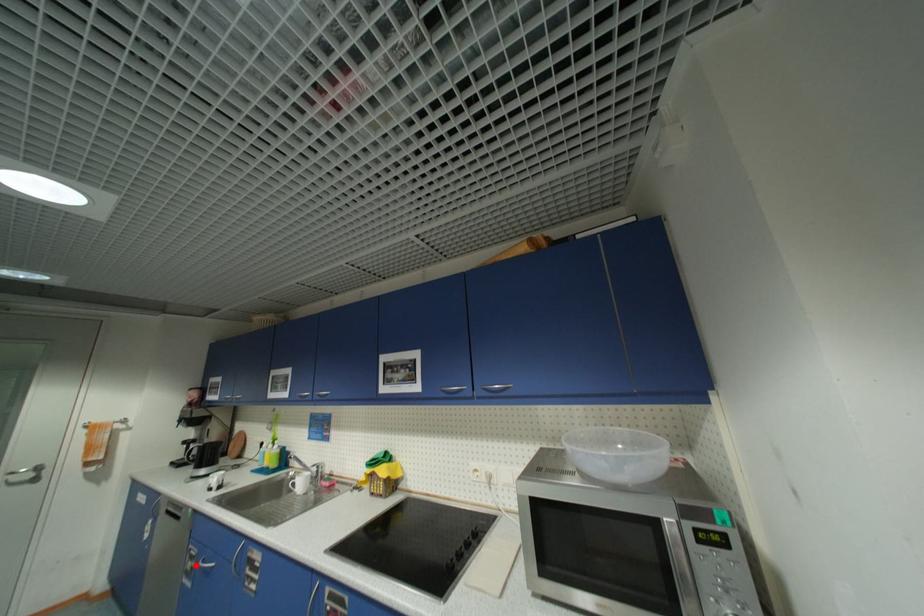
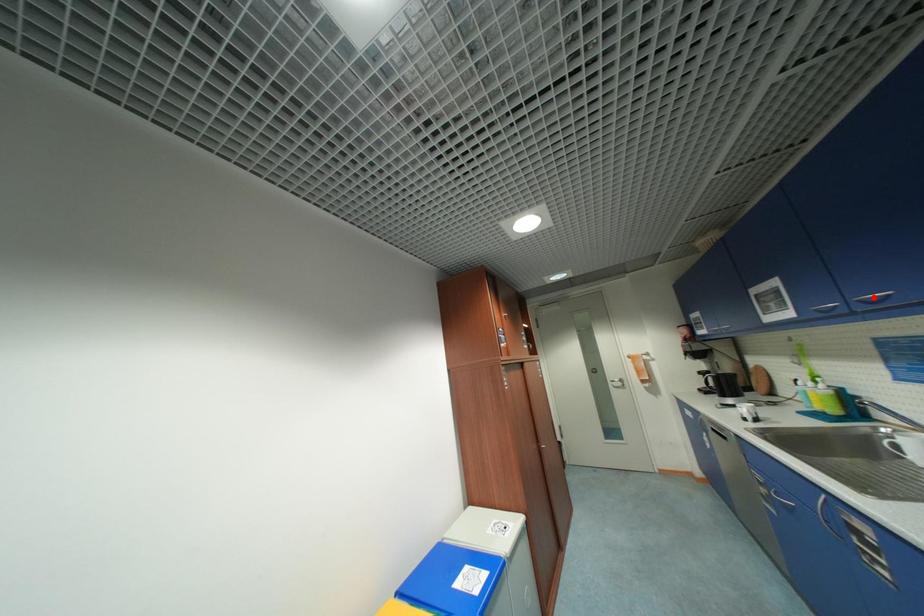
I am providing you with two images of the same scene from different viewpoints. A red point is marked on the first image and another point is marked on the second image. Is the marked point in image1 the same physical position as the marked point in image2?

No